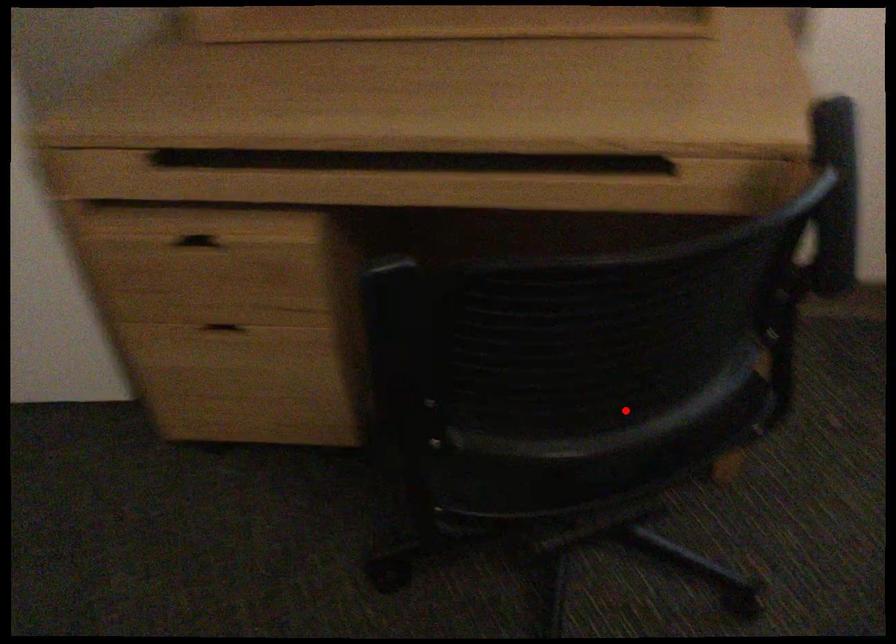
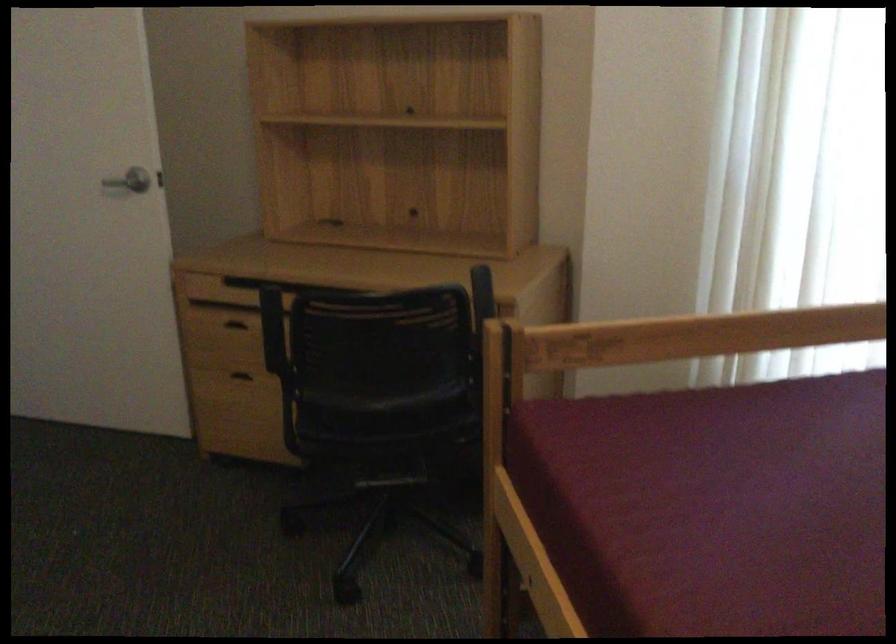
Where in the second image is the point corresponding to the highlighted location from the first image?

(383, 391)